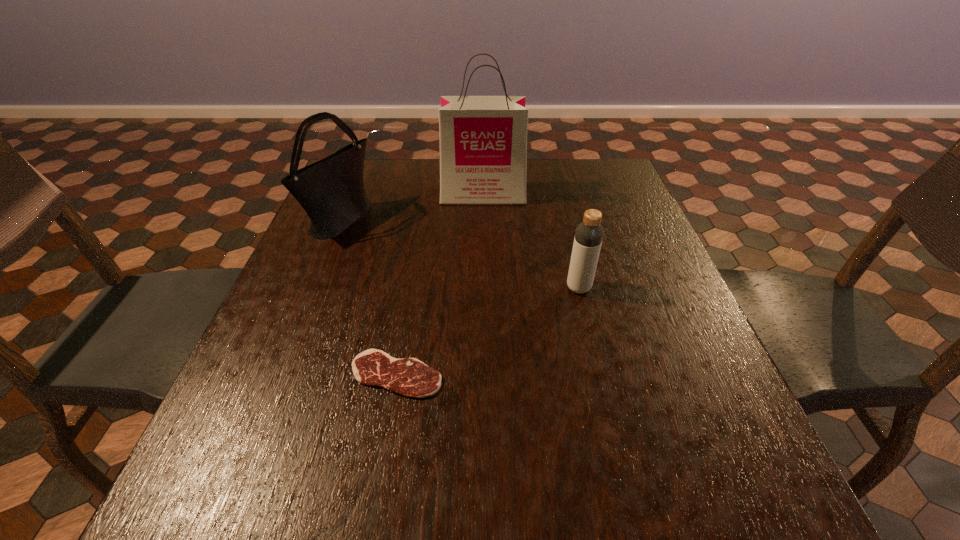
Where is `the tallest object`? The image size is (960, 540). the tallest object is located at coordinates (483, 139).

I want to click on shoulder bag, so click(x=331, y=191).

Identify the location of the leftmost object. (331, 191).

Identify the location of the third tallest object. (589, 233).

You are a GUI agent. You are given a task and a screenshot of the screen. Output one action in this format:
    pyautogui.click(x=<x>, y=<y>)
    Task: Click on the bottle
    
    Given the screenshot: What is the action you would take?
    pyautogui.click(x=589, y=233)

Identify the location of the nearest object. This screenshot has width=960, height=540. (409, 377).

What are the coordinates of `the shortest object` in the screenshot? It's located at (409, 377).

The image size is (960, 540). I want to click on vacant space located 0.090m on the front-facing side of the shopping bag, so click(483, 224).

Identify the location of vacant space situated on the front of the second tallest object. Image resolution: width=960 pixels, height=540 pixels. pyautogui.click(x=313, y=291).

Locate an element on the screen. The width and height of the screenshot is (960, 540). blank space located 0.170m on the back of the bottle is located at coordinates click(x=566, y=235).